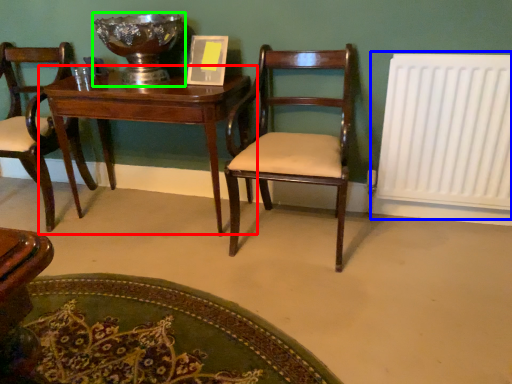
Question: Which object is the closest to the table (highlighted by a red box)? Choose among these: radiator (highlighted by a blue box) or glass bowl (highlighted by a green box).

Choices:
 (A) radiator
 (B) glass bowl

Answer: (B)